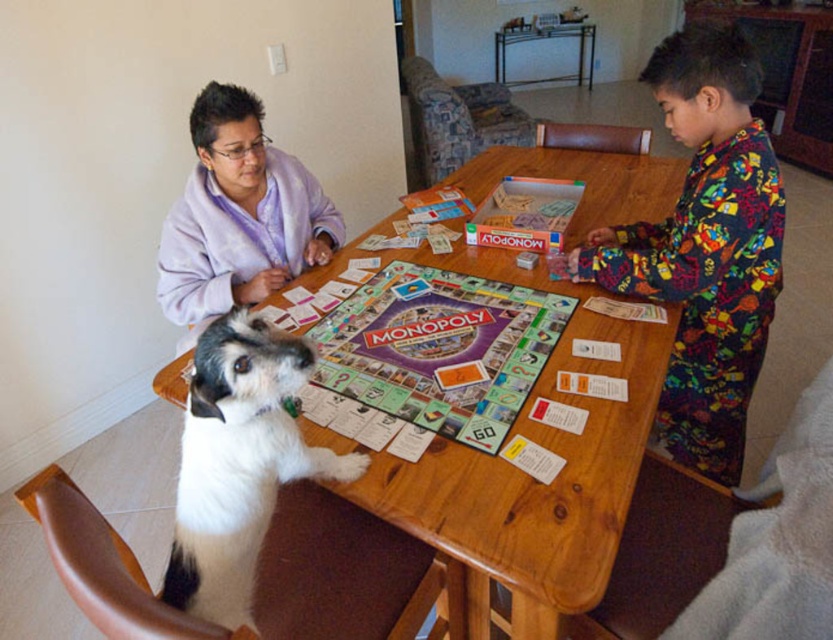
Is wooden table at center smaller than purple fleece at upper left?

Incorrect, wooden table at center is not smaller in size than purple fleece at upper left.

Does wooden table at center appear on the left side of purple fleece at upper left?

In fact, wooden table at center is to the right of purple fleece at upper left.

Is point (353, 497) behind point (290, 244)?

No, (353, 497) is in front of (290, 244).

Where is `wooden table at center`? wooden table at center is located at coordinates (534, 488).

Does wooden table at center have a larger size compared to white fur dog at center?

Yes.

Does wooden table at center come behind white fur dog at center?

Yes, wooden table at center is further from the viewer.

Identify the location of wooden table at center. The height and width of the screenshot is (640, 833). (534, 488).

The image size is (833, 640). Identify the location of wooden table at center. (534, 488).

Can you confirm if multicolored pajamas at right is thinner than purple fleece at upper left?

In fact, multicolored pajamas at right might be wider than purple fleece at upper left.

Who is more distant from viewer, (779, 221) or (243, 102)?

Positioned behind is point (243, 102).

At what (x,y) coordinates should I click in order to perform the action: click on multicolored pajamas at right. Please return your answer as a coordinate pair (x, y). Image resolution: width=833 pixels, height=640 pixels. Looking at the image, I should click on (704, 246).